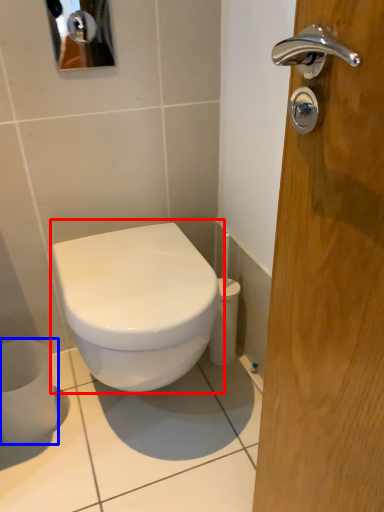
Question: Which object is further to the camera taking this photo, toilet (highlighted by a red box) or toilet paper (highlighted by a blue box)?

Choices:
 (A) toilet
 (B) toilet paper

Answer: (B)